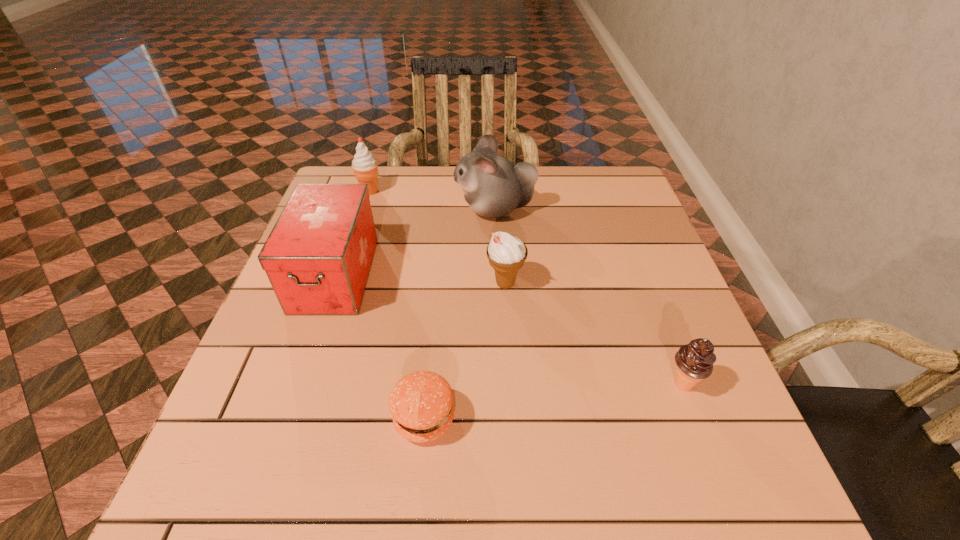
The width and height of the screenshot is (960, 540). In order to click on free space that is in between the shortest icecream and the first-aid kit in this screenshot , I will do `click(509, 329)`.

Locate an element on the screen. The image size is (960, 540). free space between the leftmost icecream and the hamster is located at coordinates (432, 200).

Find the location of a particular element. Image resolution: width=960 pixels, height=540 pixels. empty space that is in between the second icecream from left to right and the patty is located at coordinates (465, 351).

Identify which object is the fourth closest to the second icecream from right to left. Please provide its 2D coordinates. Your answer should be formatted as a tuple, i.e. [(x, y)], where the tuple contains the x and y coordinates of a point satisfying the conditions above.

[(695, 360)]

Identify which object is located as the second nearest to the rightmost icecream. Please provide its 2D coordinates. Your answer should be formatted as a tuple, i.e. [(x, y)], where the tuple contains the x and y coordinates of a point satisfying the conditions above.

[(421, 404)]

Identify which icecream is the second nearest to the farthest icecream. Please provide its 2D coordinates. Your answer should be formatted as a tuple, i.e. [(x, y)], where the tuple contains the x and y coordinates of a point satisfying the conditions above.

[(695, 360)]

I want to click on icecream identified as the closest to the second shortest object, so click(x=507, y=254).

You are a GUI agent. You are given a task and a screenshot of the screen. Output one action in this format:
    pyautogui.click(x=<x>, y=<y>)
    Task: Click on the free space that satisfies the following two spatial constraints: 1. on the handle side of the first-aid kit; 2. on the left side of the second nearest icecream
    The height and width of the screenshot is (540, 960).
    Given the screenshot: What is the action you would take?
    pyautogui.click(x=332, y=284)

Identify the location of free space that satisfies the following two spatial constraints: 1. on the face of the hamster; 2. on the handle side of the first-aid kit. (497, 275).

Where is `free space that satisfies the following two spatial constraints: 1. on the back side of the second farthest icecream; 2. on the face of the hamster`? The width and height of the screenshot is (960, 540). free space that satisfies the following two spatial constraints: 1. on the back side of the second farthest icecream; 2. on the face of the hamster is located at coordinates (501, 209).